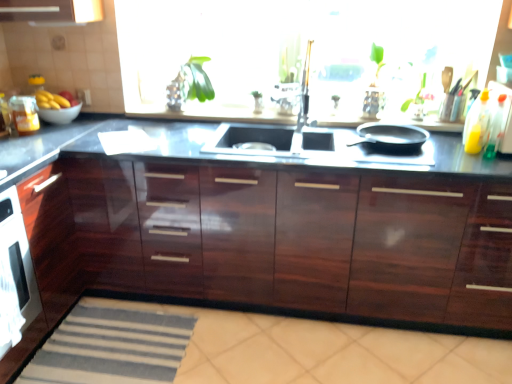
Question: Is yellow matte bananas at left smaller than glossy black countertop at center?

Choices:
 (A) no
 (B) yes

Answer: (B)

Question: Is yellow matte bananas at left positioned behind glossy black countertop at center?

Choices:
 (A) no
 (B) yes

Answer: (B)

Question: Is yellow matte bananas at left at the right side of glossy black countertop at center?

Choices:
 (A) no
 (B) yes

Answer: (A)

Question: Is yellow matte bananas at left not close to glossy black countertop at center?

Choices:
 (A) yes
 (B) no

Answer: (A)

Question: Considering the relative positions of yellow matte bananas at left and glossy black countertop at center in the image provided, is yellow matte bananas at left to the left of glossy black countertop at center from the viewer's perspective?

Choices:
 (A) no
 (B) yes

Answer: (B)

Question: Looking at their shapes, would you say translucent plastic bottle at right, which is counted as the 1th bottle, starting from the front, is wider or thinner than transparent glass window at center?

Choices:
 (A) thin
 (B) wide

Answer: (A)

Question: Which is correct: translucent plastic bottle at right, which is counted as the 1th bottle, starting from the front, is inside transparent glass window at center, or outside of it?

Choices:
 (A) inside
 (B) outside

Answer: (B)

Question: In the image, is translucent plastic bottle at right, which is counted as the 1th bottle, starting from the front, on the left side or the right side of transparent glass window at center?

Choices:
 (A) left
 (B) right

Answer: (B)

Question: Does point (496, 129) appear closer or farther from the camera than point (390, 39)?

Choices:
 (A) farther
 (B) closer

Answer: (B)

Question: In terms of width, does yellow matte bananas at left look wider or thinner when compared to transparent glass window at center?

Choices:
 (A) wide
 (B) thin

Answer: (A)

Question: From the image's perspective, is yellow matte bananas at left above or below transparent glass window at center?

Choices:
 (A) below
 (B) above

Answer: (A)

Question: Considering the positions of yellow matte bananas at left and transparent glass window at center in the image, is yellow matte bananas at left taller or shorter than transparent glass window at center?

Choices:
 (A) tall
 (B) short

Answer: (B)

Question: Does point (35, 94) appear closer or farther from the camera than point (411, 59)?

Choices:
 (A) farther
 (B) closer

Answer: (A)

Question: From the image's perspective, is transparent glass window at center above or below black matte frying pan at right?

Choices:
 (A) above
 (B) below

Answer: (A)

Question: Is point (394, 92) positioned closer to the camera than point (379, 148)?

Choices:
 (A) farther
 (B) closer

Answer: (A)